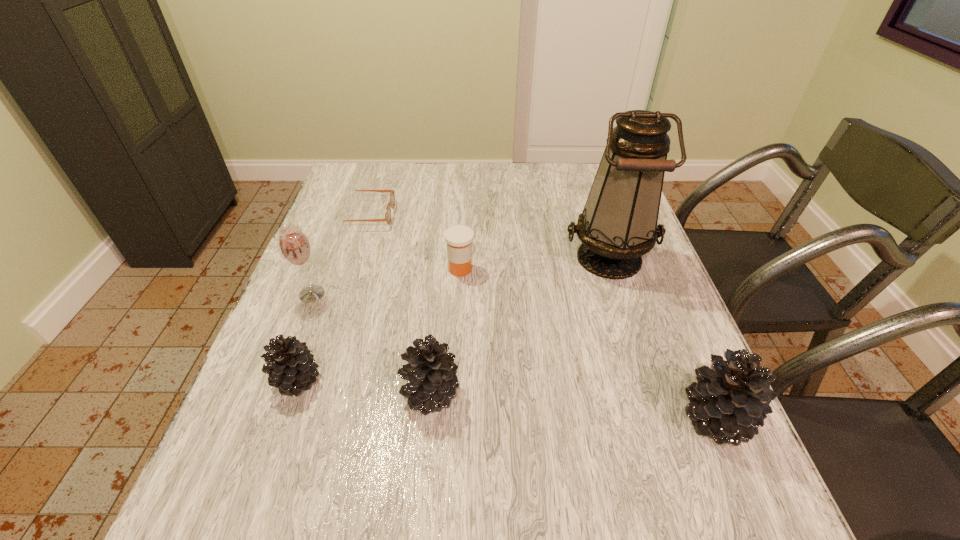
Please determine a free point for an extra pinecone to ensure balance. Please provide its 2D coordinates. Your answer should be formatted as a tuple, i.e. [(x, y)], where the tuple contains the x and y coordinates of a point satisfying the conditions above.

[(570, 405)]